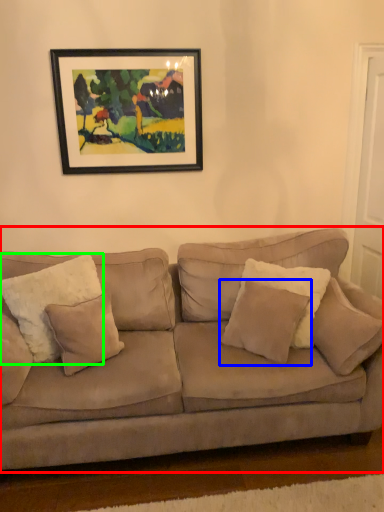
Question: Based on their relative distances, which object is nearer to studio couch (highlighted by a red box)? Choose from pillow (highlighted by a blue box) and pillow (highlighted by a green box).

Choices:
 (A) pillow
 (B) pillow

Answer: (A)